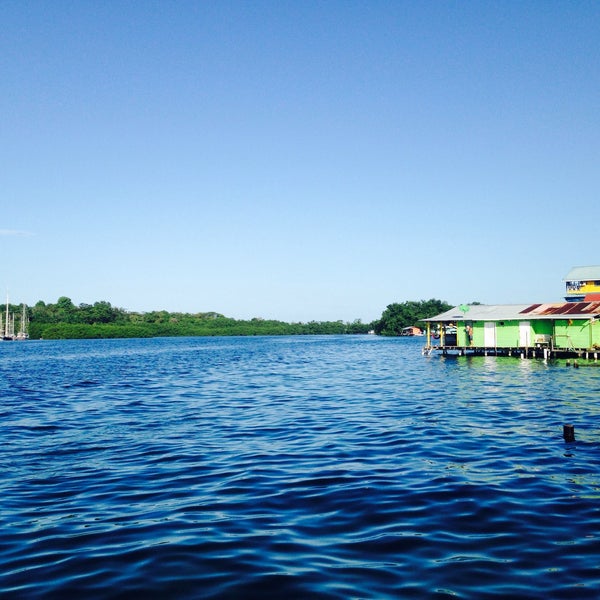
Where is `walls`? This screenshot has height=600, width=600. walls is located at coordinates (588, 284), (508, 335), (577, 334).